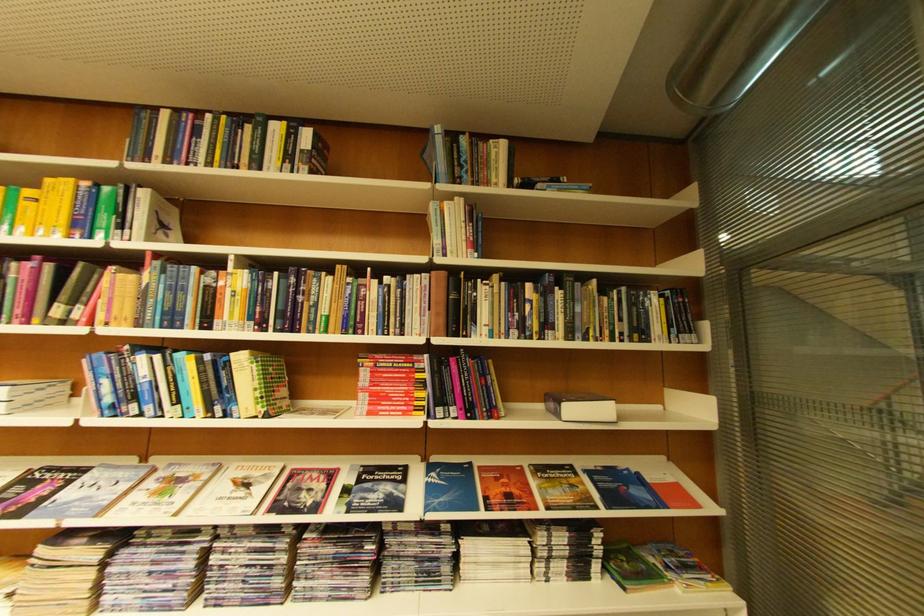
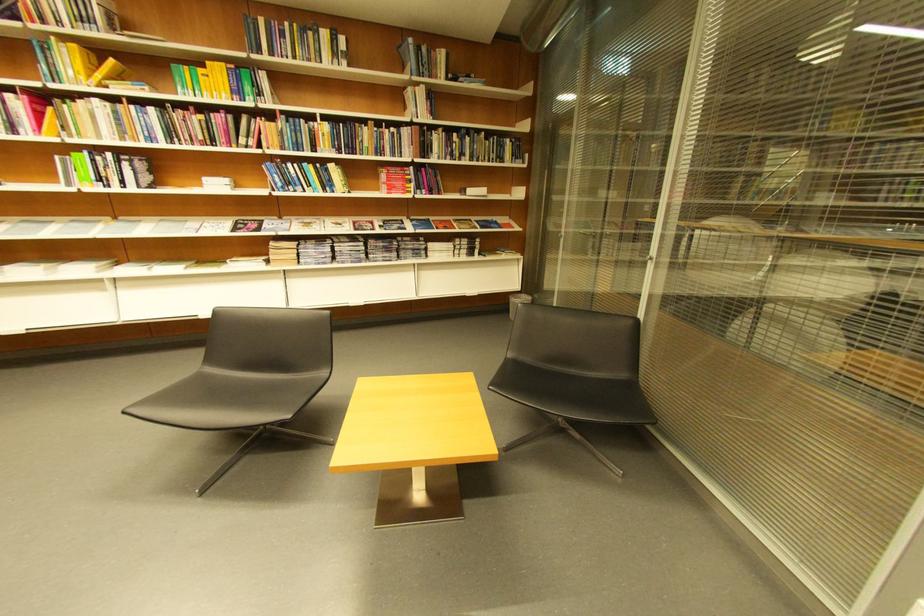
The point at (119, 402) is marked in the first image. Where is the corresponding point in the second image?

(290, 185)